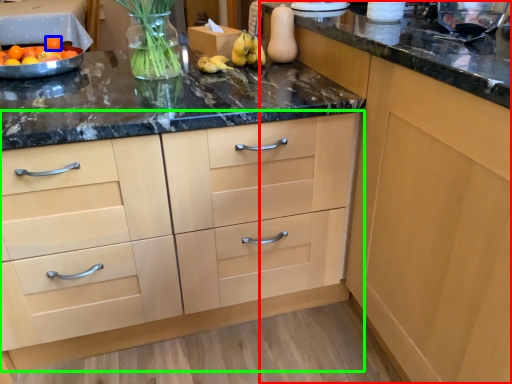
Question: Based on their relative distances, which object is nearer to cabinetry (highlighted by a red box)? Choose from tangerine (highlighted by a blue box) and cabinetry (highlighted by a green box).

Choices:
 (A) tangerine
 (B) cabinetry

Answer: (B)